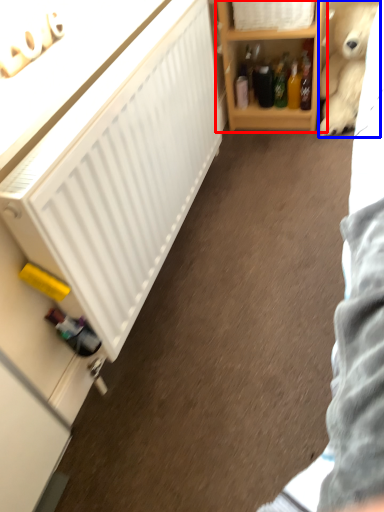
Question: Which object appears closest to the camera in this image, shelf (highlighted by a red box) or teddy bear (highlighted by a blue box)?

Choices:
 (A) shelf
 (B) teddy bear

Answer: (A)